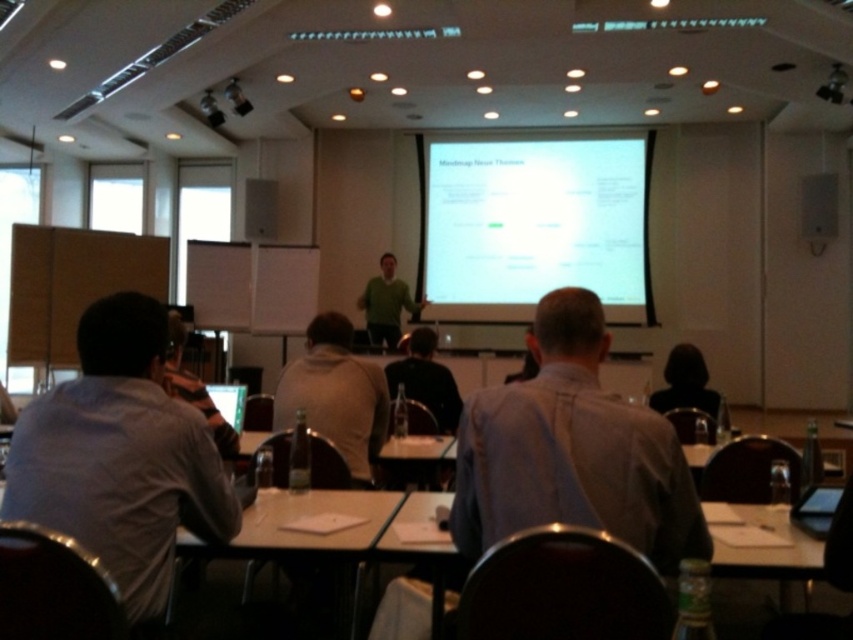
Who is higher up, gray shirt at left or light blue shirt at center?

light blue shirt at center

Locate an element on the screen. gray shirt at left is located at coordinates (120, 456).

Who is more distant from viewer, (169, 385) or (825, 92)?

Point (825, 92)

Which is above, gray fabric shirt at center or black plastic projector at upper right?

black plastic projector at upper right is above.

The height and width of the screenshot is (640, 853). What do you see at coordinates (194, 388) in the screenshot?
I see `gray fabric shirt at center` at bounding box center [194, 388].

You are a GUI agent. You are given a task and a screenshot of the screen. Output one action in this format:
    pyautogui.click(x=<x>, y=<y>)
    Task: Click on the gray fabric shirt at center
    
    Given the screenshot: What is the action you would take?
    pyautogui.click(x=194, y=388)

Can you confirm if white paper at center is positioned above black plastic projector at upper right?

Actually, white paper at center is below black plastic projector at upper right.

Based on the photo, measure the distance between white paper at center and camera.

white paper at center is 3.20 meters from camera.

Where is `white paper at center`? white paper at center is located at coordinates (762, 573).

Where is `white paper at center`? The image size is (853, 640). white paper at center is located at coordinates (762, 573).